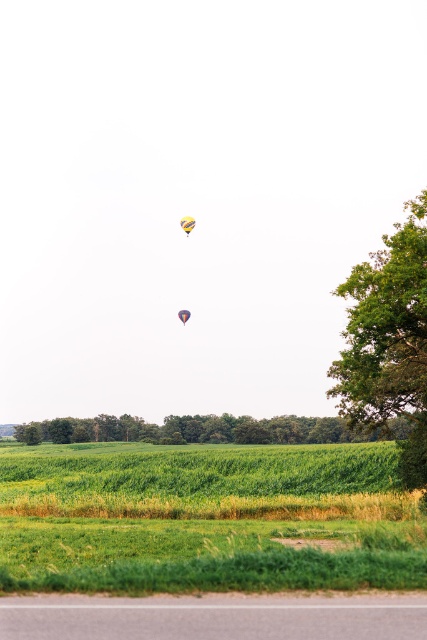
Question: Is green grassy field at lower center above green leafy tree at center?

Choices:
 (A) no
 (B) yes

Answer: (B)

Question: Is green leafy tree at right to the right of green leafy tree at center from the viewer's perspective?

Choices:
 (A) yes
 (B) no

Answer: (B)

Question: Which point is farther to the camera?

Choices:
 (A) green leafy tree at right
 (B) multicolored fabric balloon at upper center
 (C) green leafy tree at center
 (D) green grassy field at lower center

Answer: (B)

Question: Which point is farther to the camera?

Choices:
 (A) green grassy field at lower center
 (B) green leafy tree at center
 (C) green leafy tree at right
 (D) multicolored fabric balloon at upper center

Answer: (D)

Question: Which object appears closest to the camera in this image?

Choices:
 (A) green leafy tree at right
 (B) green grassy field at lower center

Answer: (B)

Question: Is green leafy tree at right wider than green leafy tree at center?

Choices:
 (A) yes
 (B) no

Answer: (B)